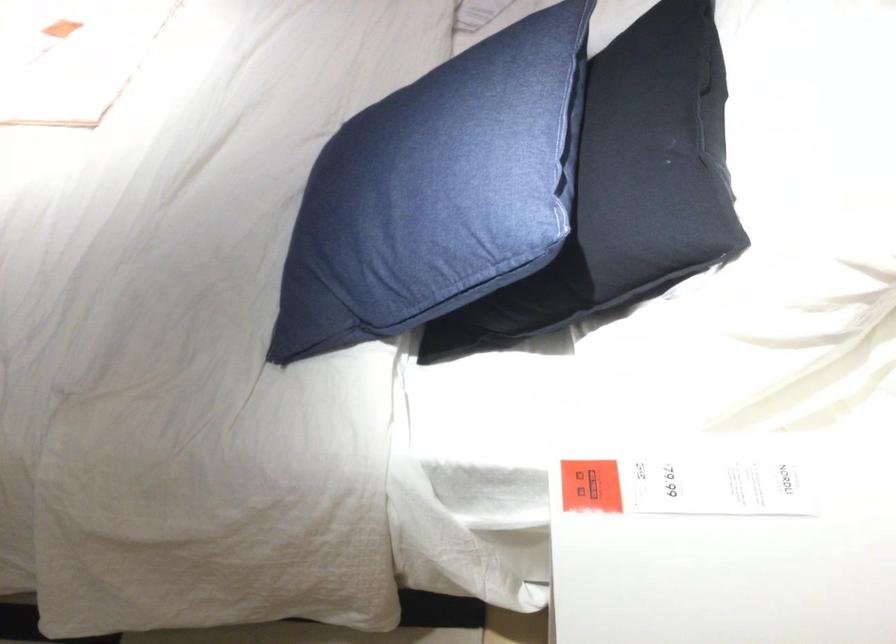
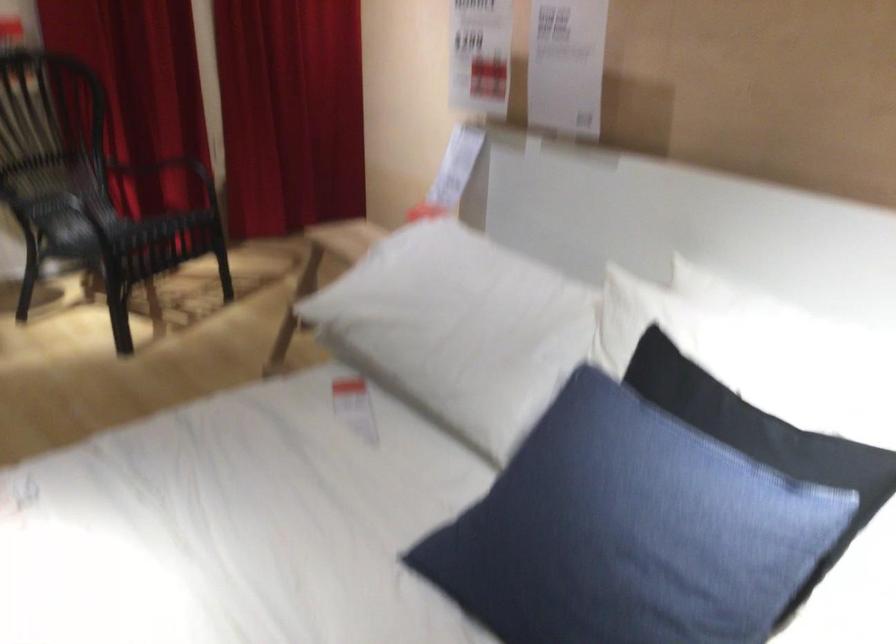
Looking at this image, based on the continuous images, in which direction is the camera rotating?

The camera's rotation is toward right-up.